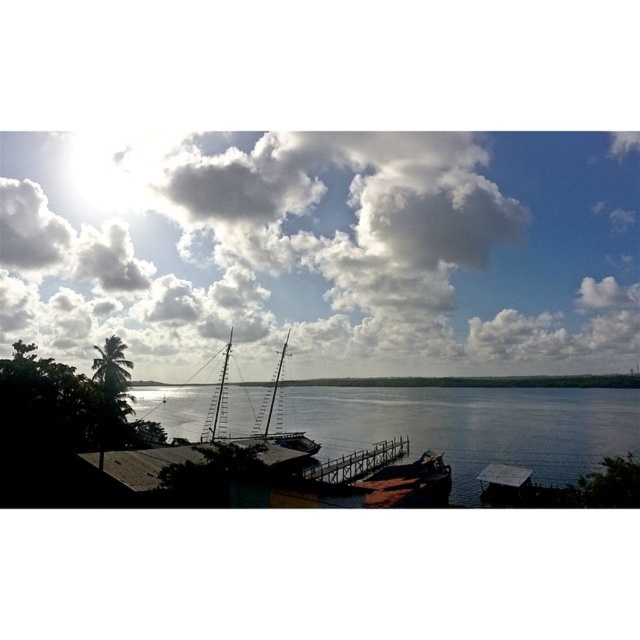
Question: Which object is farther from the camera taking this photo?

Choices:
 (A) rusty metal dock at lower left
 (B) wooden dock at center

Answer: (A)

Question: Among these points, which one is farthest from the camera?

Choices:
 (A) (340, 483)
 (B) (211, 346)
 (C) (304, 413)

Answer: (B)

Question: Is white fluffy cloud at upper center behind rusty metal dock at lower left?

Choices:
 (A) no
 (B) yes

Answer: (B)

Question: Which of these objects is positioned farthest from the wooden dock at center?

Choices:
 (A) wooden sailboat at center
 (B) white fluffy cloud at upper center
 (C) transparent water at center
 (D) rusty metal dock at lower left

Answer: (B)

Question: Is rusty metal dock at lower left bigger than wooden dock at center?

Choices:
 (A) yes
 (B) no

Answer: (B)

Question: Does transparent water at center appear over rusty metal dock at lower left?

Choices:
 (A) yes
 (B) no

Answer: (B)